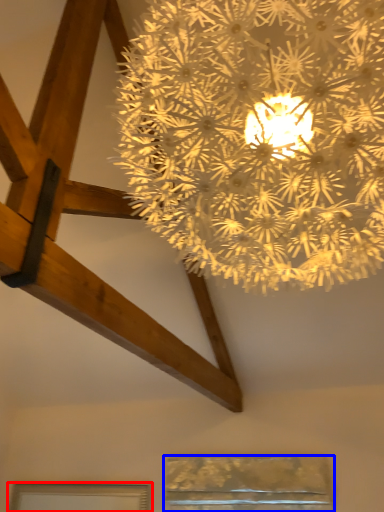
Question: Which object appears closest to the camera in this image, window (highlighted by a red box) or window (highlighted by a blue box)?

Choices:
 (A) window
 (B) window

Answer: (B)